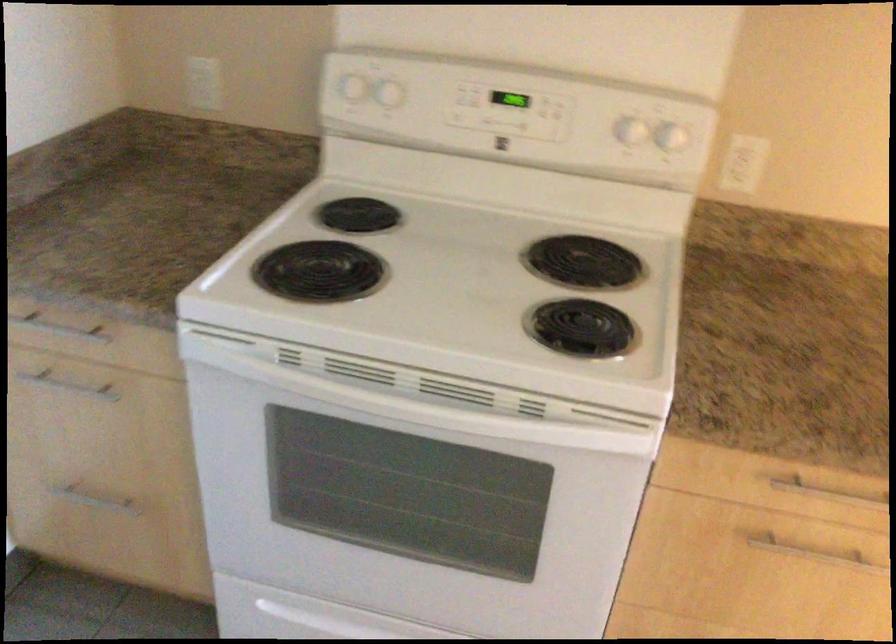
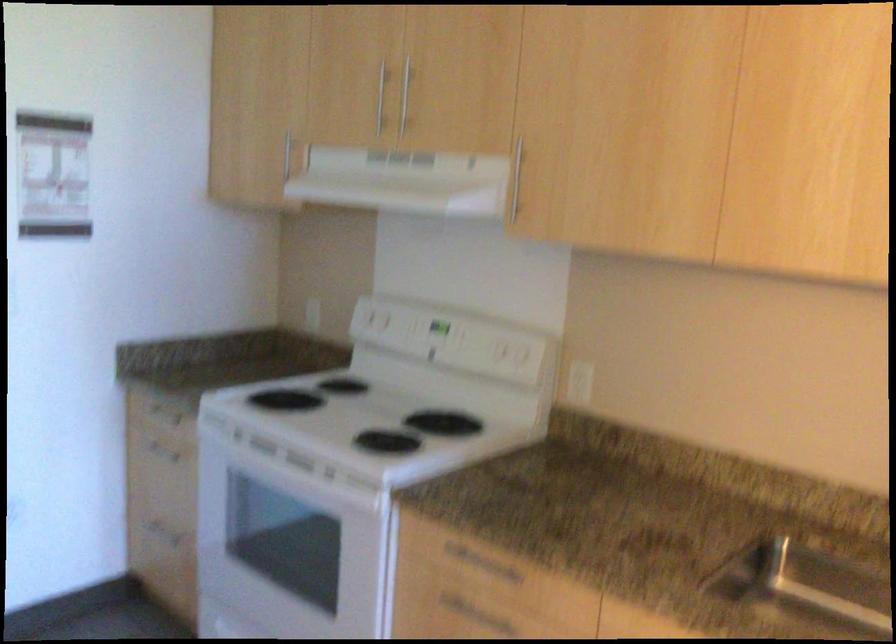
The point at (x=762, y=534) is marked in the first image. Where is the corresponding point in the second image?

(466, 609)